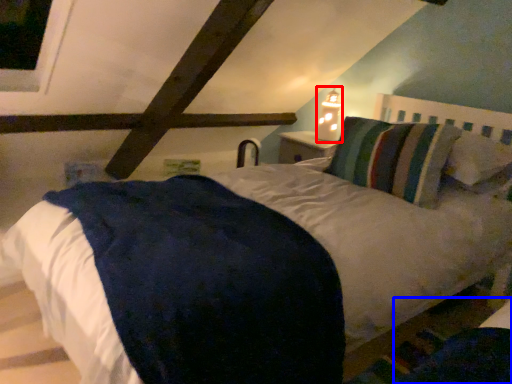
Question: Which of the following is the closest to the observer, bedside lamp (highlighted by a red box) or dark (highlighted by a blue box)?

Choices:
 (A) bedside lamp
 (B) dark

Answer: (B)